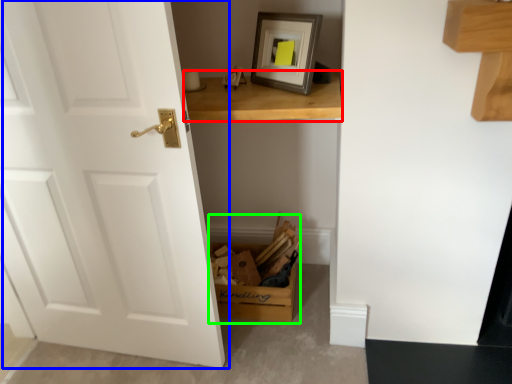
Question: Based on their relative distances, which object is nearer to table (highlighted by a red box)? Choose from door (highlighted by a blue box) and cardboard box (highlighted by a green box).

Choices:
 (A) door
 (B) cardboard box

Answer: (A)